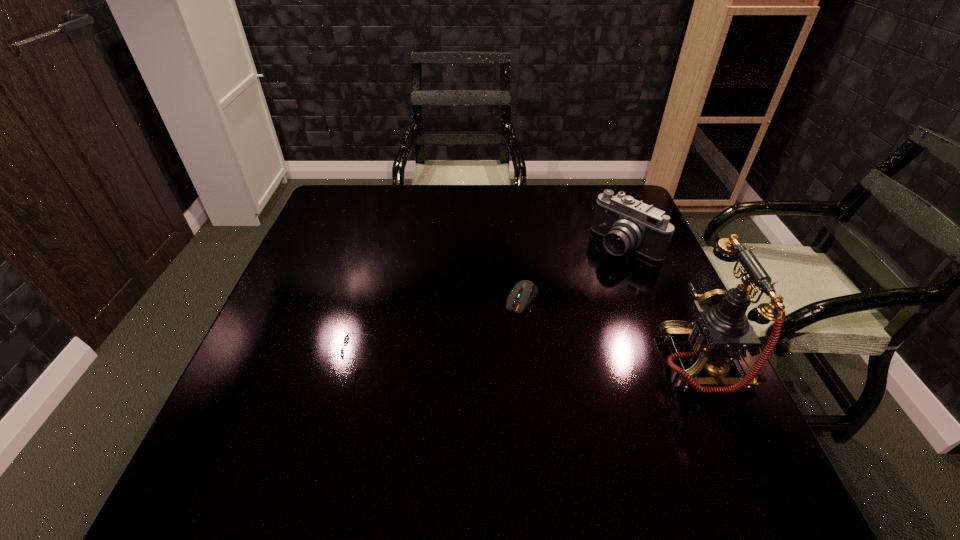
Identify the location of sunglasses. (346, 340).

I want to click on the leftmost object, so click(346, 340).

What are the coordinates of `the tallest object` in the screenshot? It's located at (720, 331).

What are the coordinates of `camera` in the screenshot? It's located at (627, 224).

In order to click on the third shortest object in this screenshot , I will do `click(627, 224)`.

Image resolution: width=960 pixels, height=540 pixels. Find the location of `the third nearest object`. the third nearest object is located at coordinates tap(523, 292).

This screenshot has width=960, height=540. Identify the location of computer equipment. (523, 292).

The width and height of the screenshot is (960, 540). Find the location of `free point located 0.150m in front of the lenses of the sunglasses`. free point located 0.150m in front of the lenses of the sunglasses is located at coordinates (276, 363).

Identify the location of vacant space located in front of the lenses of the sunglasses. (304, 363).

Identify the location of free region located 0.130m in front of the lenses of the sunglasses. Image resolution: width=960 pixels, height=540 pixels. (285, 363).